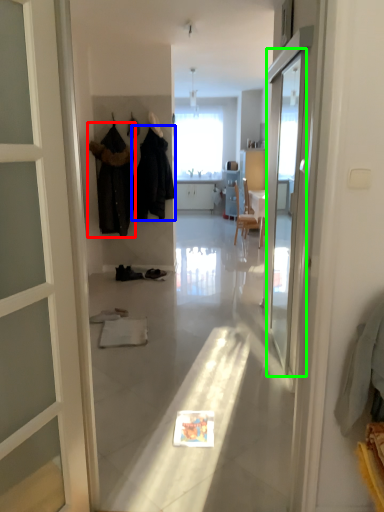
Question: Based on their relative distances, which object is farther from clothing (highlighted by a red box)? Choose from clothing (highlighted by a blue box) and screen door (highlighted by a green box).

Choices:
 (A) clothing
 (B) screen door

Answer: (B)